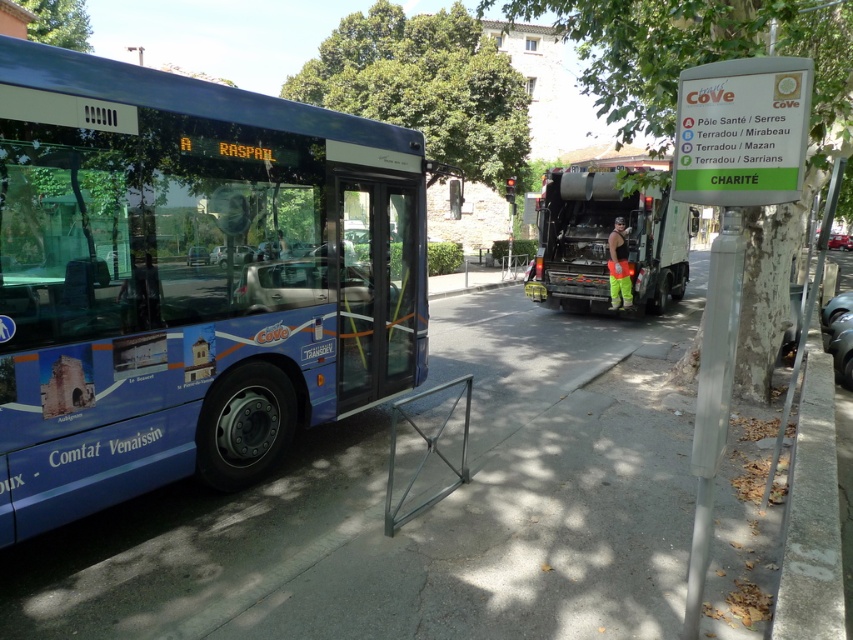
Between blue metallic bus at left and gray concrete pavement at center, which one is positioned higher?

blue metallic bus at left is higher up.

Is point (119, 336) in front of point (598, 509)?

That is True.

The height and width of the screenshot is (640, 853). I want to click on blue metallic bus at left, so click(189, 280).

Measure the distance between point (x=722, y=352) and camera.

Point (x=722, y=352) is 2.72 meters away from camera.

Is white plastic sign at upper right smaller than reflective orange vest at center?

Actually, white plastic sign at upper right might be larger than reflective orange vest at center.

The height and width of the screenshot is (640, 853). Find the location of `white plastic sign at upper right`. white plastic sign at upper right is located at coordinates (730, 230).

Is blue metallic bus at left in front of blue painted bus at center?

Yes, blue metallic bus at left is closer to the viewer.

Where is `blue metallic bus at left`? Image resolution: width=853 pixels, height=640 pixels. blue metallic bus at left is located at coordinates (189, 280).

You are a GUI agent. You are given a task and a screenshot of the screen. Output one action in this format:
    pyautogui.click(x=<x>, y=<y>)
    Task: Click on the blue metallic bus at left
    
    Given the screenshot: What is the action you would take?
    pyautogui.click(x=189, y=280)